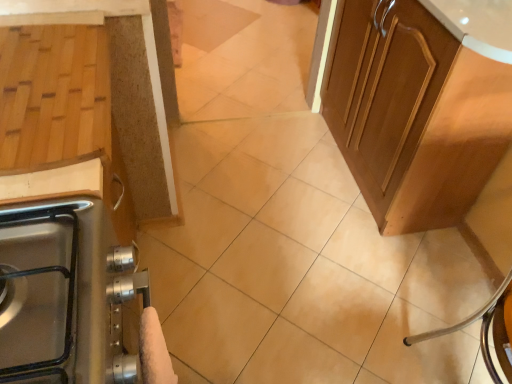
Question: From the image's perspective, is white fluffy hand towel at lower left beneath glossy wood cabinet at upper right, which is counted as the first cabinetry, starting from the right?

Choices:
 (A) yes
 (B) no

Answer: (A)

Question: From a real-world perspective, is white fluffy hand towel at lower left under glossy wood cabinet at upper right, which is counted as the first cabinetry, starting from the right?

Choices:
 (A) no
 (B) yes

Answer: (A)

Question: Is white fluffy hand towel at lower left completely or partially outside of glossy wood cabinet at upper right, which is counted as the first cabinetry, starting from the right?

Choices:
 (A) no
 (B) yes

Answer: (B)

Question: Can you confirm if white fluffy hand towel at lower left is positioned to the right of glossy wood cabinet at upper right, which is counted as the first cabinetry, starting from the right?

Choices:
 (A) no
 (B) yes

Answer: (A)

Question: Are white fluffy hand towel at lower left and glossy wood cabinet at upper right, which is the 2th cabinetry in left-to-right order, located far from each other?

Choices:
 (A) yes
 (B) no

Answer: (A)

Question: In the image, is wooden cutting board at left, positioned as the 2th cabinetry in right-to-left order, positioned in front of or behind white fluffy hand towel at lower left?

Choices:
 (A) front
 (B) behind

Answer: (B)

Question: Considering the positions of wooden cutting board at left, the 1th cabinetry when ordered from left to right, and white fluffy hand towel at lower left in the image, is wooden cutting board at left, the 1th cabinetry when ordered from left to right, wider or thinner than white fluffy hand towel at lower left?

Choices:
 (A) thin
 (B) wide

Answer: (B)

Question: From the image's perspective, is wooden cutting board at left, positioned as the 2th cabinetry in right-to-left order, above or below white fluffy hand towel at lower left?

Choices:
 (A) above
 (B) below

Answer: (A)

Question: Is wooden cutting board at left, positioned as the 2th cabinetry in right-to-left order, bigger or smaller than white fluffy hand towel at lower left?

Choices:
 (A) small
 (B) big

Answer: (B)

Question: Is glossy wood cabinet at upper right, which is the 2th cabinetry in left-to-right order, spatially inside white fluffy hand towel at lower left, or outside of it?

Choices:
 (A) outside
 (B) inside

Answer: (A)

Question: Does point (411, 135) appear closer or farther from the camera than point (159, 364)?

Choices:
 (A) closer
 (B) farther

Answer: (B)

Question: Is glossy wood cabinet at upper right, which is the 2th cabinetry in left-to-right order, taller or shorter than white fluffy hand towel at lower left?

Choices:
 (A) tall
 (B) short

Answer: (A)

Question: From a real-world perspective, is glossy wood cabinet at upper right, which is the 2th cabinetry in left-to-right order, physically located above or below white fluffy hand towel at lower left?

Choices:
 (A) above
 (B) below

Answer: (B)

Question: Considering the positions of white fluffy hand towel at lower left and glossy wood cabinet at upper right, which is counted as the first cabinetry, starting from the right, in the image, is white fluffy hand towel at lower left bigger or smaller than glossy wood cabinet at upper right, which is counted as the first cabinetry, starting from the right,?

Choices:
 (A) big
 (B) small

Answer: (B)

Question: Do you think white fluffy hand towel at lower left is within glossy wood cabinet at upper right, which is counted as the first cabinetry, starting from the right, or outside of it?

Choices:
 (A) outside
 (B) inside

Answer: (A)